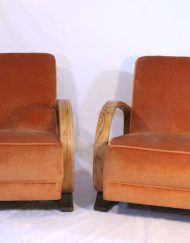
The image size is (190, 243). I want to click on dark shadows reflecting under chairs, so pos(150,212), pos(41,206).